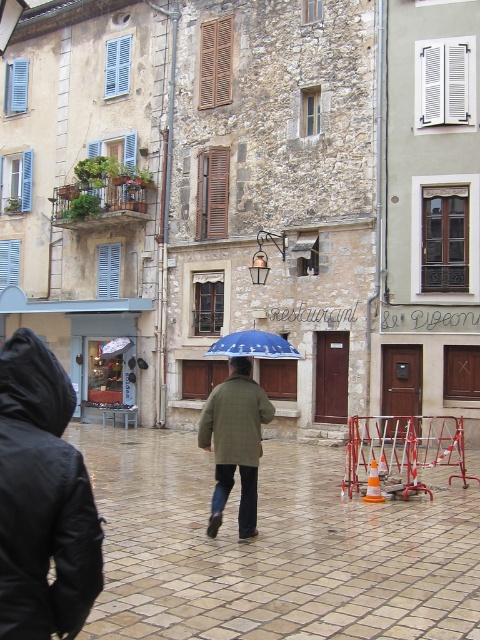
Question: Does green matte coat at center have a lesser width compared to blue fabric umbrella at center?

Choices:
 (A) no
 (B) yes

Answer: (B)

Question: Considering the relative positions of brown stone pavement at center and green matte coat at center in the image provided, where is brown stone pavement at center located with respect to green matte coat at center?

Choices:
 (A) above
 (B) below

Answer: (B)

Question: Which of the following is the closest to the observer?

Choices:
 (A) (255, 333)
 (B) (241, 392)

Answer: (B)

Question: Which of these objects is positioned closest to the brown stone pavement at center?

Choices:
 (A) green matte coat at center
 (B) blue fabric umbrella at center

Answer: (B)

Question: Which of the following is the farthest from the observer?

Choices:
 (A) (230, 362)
 (B) (284, 588)

Answer: (A)

Question: Is brown stone pavement at center positioned before blue fabric umbrella at center?

Choices:
 (A) yes
 (B) no

Answer: (A)